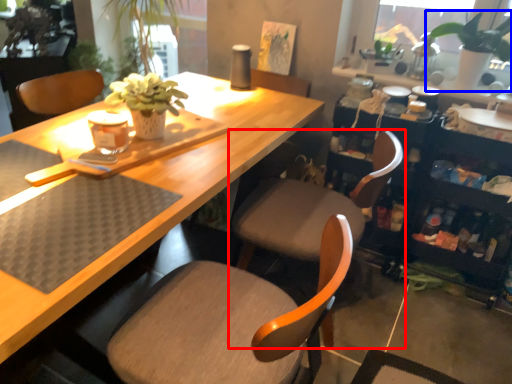
Question: Which point is further to the camera, chair (highlighted by a red box) or houseplant (highlighted by a blue box)?

Choices:
 (A) chair
 (B) houseplant

Answer: (B)